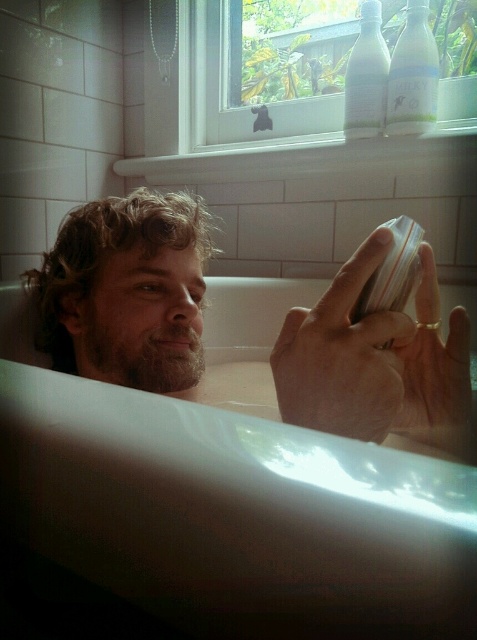
What do you see at coordinates (236, 515) in the screenshot? I see `white glossy bathtub at center` at bounding box center [236, 515].

Does white glossy bathtub at center appear under curly hair at left?

Yes, white glossy bathtub at center is below curly hair at left.

Locate an element on the screen. The image size is (477, 640). white glossy bathtub at center is located at coordinates (236, 515).

Is curly hair at left thinner than smooth skin hand at center?

No.

Can you confirm if curly hair at left is taller than smooth skin hand at center?

Correct, curly hair at left is much taller as smooth skin hand at center.

Image resolution: width=477 pixels, height=640 pixels. I want to click on curly hair at left, so click(x=126, y=291).

The image size is (477, 640). I want to click on curly hair at left, so click(x=126, y=291).

Looking at this image, can you confirm if curly hair at left is taller than gold metallic ring at upper center?

Yes, curly hair at left is taller than gold metallic ring at upper center.

Is curly hair at left below gold metallic ring at upper center?

Actually, curly hair at left is above gold metallic ring at upper center.

Is point (115, 259) positioned behind point (436, 330)?

Yes, point (115, 259) is behind point (436, 330).

You are a GUI agent. You are given a task and a screenshot of the screen. Output one action in this format:
    pyautogui.click(x=<x>, y=<y>)
    Task: Click on the curly hair at left
    
    Given the screenshot: What is the action you would take?
    pyautogui.click(x=126, y=291)